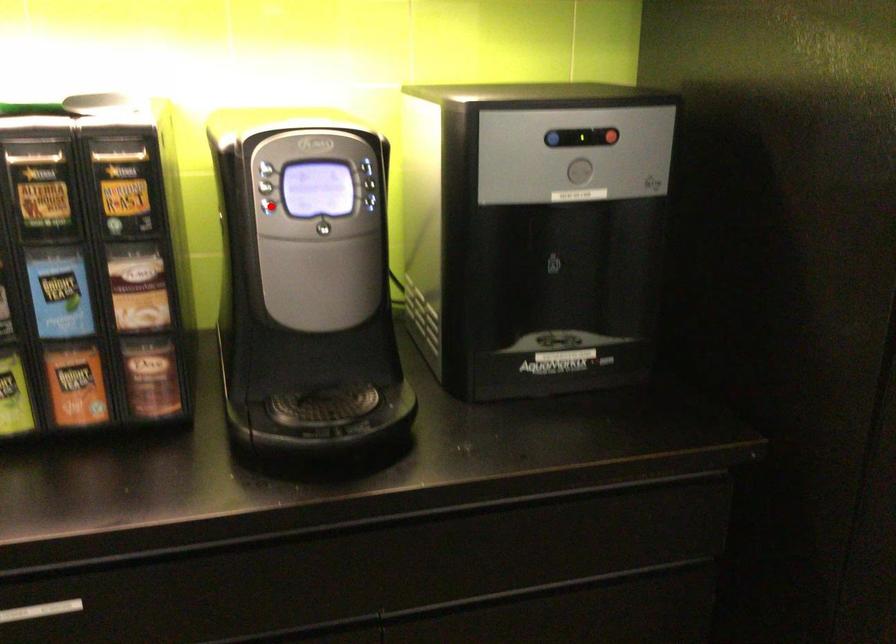
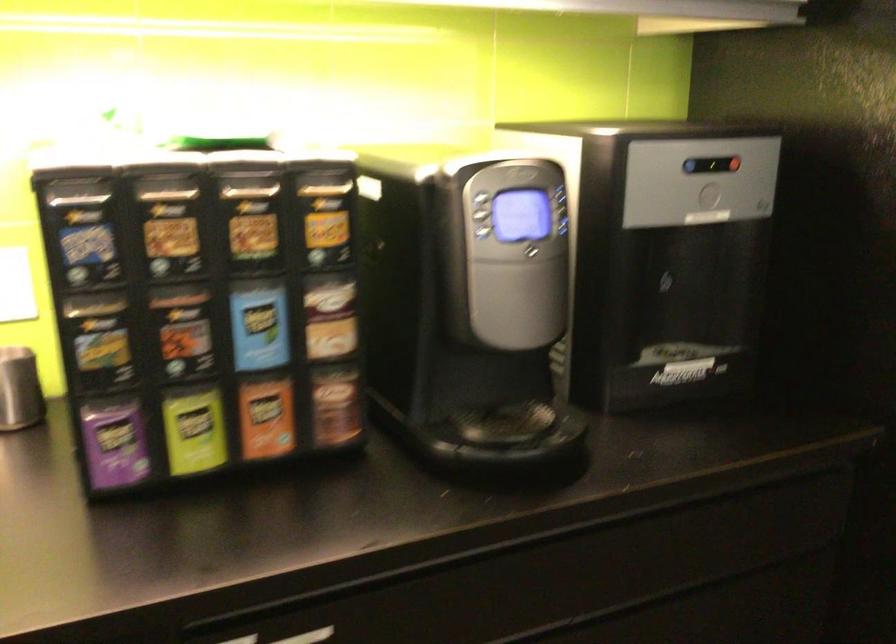
The point at the highlighted location is marked in the first image. Where is the corresponding point in the second image?

(486, 232)